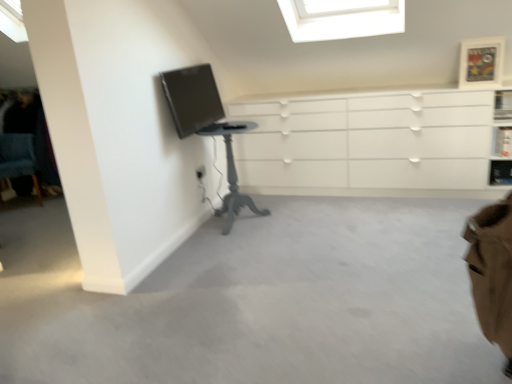
Question: Should I look upward or downward to see blue fabric chair at lower left?

Choices:
 (A) up
 (B) down

Answer: (A)

Question: Is white matte chest of drawers at center next to matte black monitor at upper left and touching it?

Choices:
 (A) no
 (B) yes

Answer: (A)

Question: Does white matte chest of drawers at center appear on the left side of matte black monitor at upper left?

Choices:
 (A) no
 (B) yes

Answer: (A)

Question: Can you confirm if white matte chest of drawers at center is bigger than matte black monitor at upper left?

Choices:
 (A) no
 (B) yes

Answer: (B)

Question: From the image's perspective, is white matte chest of drawers at center beneath matte black monitor at upper left?

Choices:
 (A) yes
 (B) no

Answer: (A)

Question: From a real-world perspective, is white matte chest of drawers at center positioned under matte black monitor at upper left based on gravity?

Choices:
 (A) yes
 (B) no

Answer: (A)

Question: Can you confirm if white matte chest of drawers at center is smaller than matte black monitor at upper left?

Choices:
 (A) no
 (B) yes

Answer: (A)

Question: Is there a large distance between gray painted wood table at left and white matte chest of drawers at center?

Choices:
 (A) yes
 (B) no

Answer: (B)

Question: Can you confirm if gray painted wood table at left is smaller than white matte chest of drawers at center?

Choices:
 (A) yes
 (B) no

Answer: (A)

Question: Can you confirm if gray painted wood table at left is bigger than white matte chest of drawers at center?

Choices:
 (A) no
 (B) yes

Answer: (A)

Question: Is gray painted wood table at left taller than white matte chest of drawers at center?

Choices:
 (A) no
 (B) yes

Answer: (A)

Question: From the image's perspective, is gray painted wood table at left beneath white matte chest of drawers at center?

Choices:
 (A) yes
 (B) no

Answer: (A)

Question: Is gray painted wood table at left further to camera compared to white matte chest of drawers at center?

Choices:
 (A) no
 (B) yes

Answer: (A)

Question: Can we say brown fabric swivel chair at lower right lies outside blue fabric chair at lower left?

Choices:
 (A) yes
 (B) no

Answer: (A)